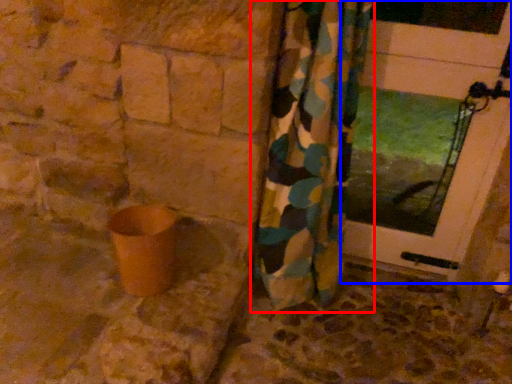
Question: Which point is closer to the camera, curtain (highlighted by a red box) or door (highlighted by a blue box)?

Choices:
 (A) curtain
 (B) door

Answer: (A)